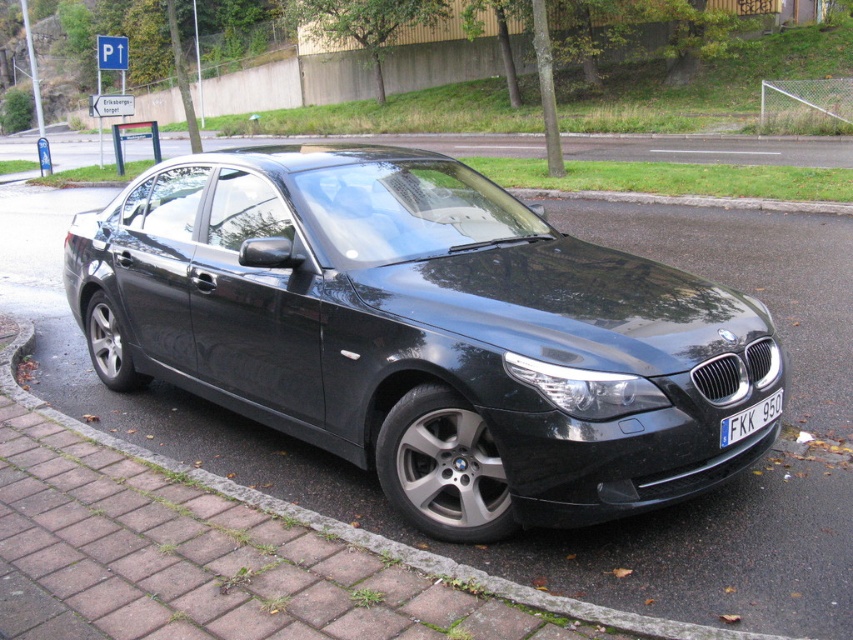
You are standing in front of a black BMW sedan parked on the side of the road. You notice two points marked on the car. The first point is at coordinates point (544, 404) and the second point is at point (726, 432). Which of these points is closer to you?

Point (544, 404) is closer to the viewer than point (726, 432).

You are standing in front of the black BMW sedan parked on the side of the road. You notice a specific point at coordinates (422, 332). What object does this point correspond to?

The point at coordinates (422, 332) corresponds to the glossy black car at center.

You are a photographer standing at a certain distance from the glossy black car at center. If you want to capture the car in your shot without moving closer, what is the minimum focal length you should use to ensure the car fills the frame adequately?

The glossy black car at center is 9.42 feet away from the camera. To ensure the car fills the frame adequately without moving closer, the minimum focal length required would depend on the sensor size of the camera. However, a general guideline is to use a focal length that corresponds to the distance multiplied by the sensor size divided by the subject size. Since specific sensor or subject dimensions aren not provided, a mid to telephoto lens around 85mm to 135mm is often recommended for portraits or close